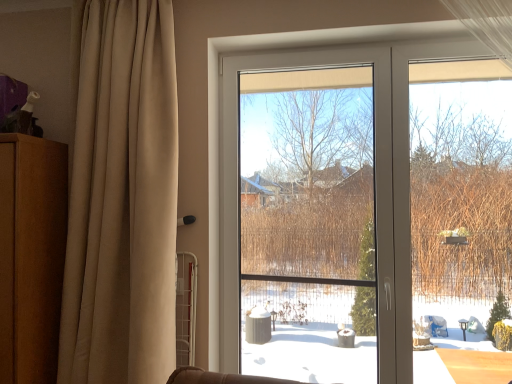
Question: In terms of size, does brown wood dresser at left appear bigger or smaller than beige fabric curtain at left?

Choices:
 (A) small
 (B) big

Answer: (A)

Question: Is brown wood dresser at left spatially inside beige fabric curtain at left, or outside of it?

Choices:
 (A) outside
 (B) inside

Answer: (A)

Question: Which is nearer to the brown wood dresser at left?

Choices:
 (A) beige fabric curtain at left
 (B) transparent plastic window screen at center

Answer: (A)

Question: Considering the real-world distances, which object is closest to the beige fabric curtain at left?

Choices:
 (A) transparent plastic window screen at center
 (B) brown wood dresser at left

Answer: (B)